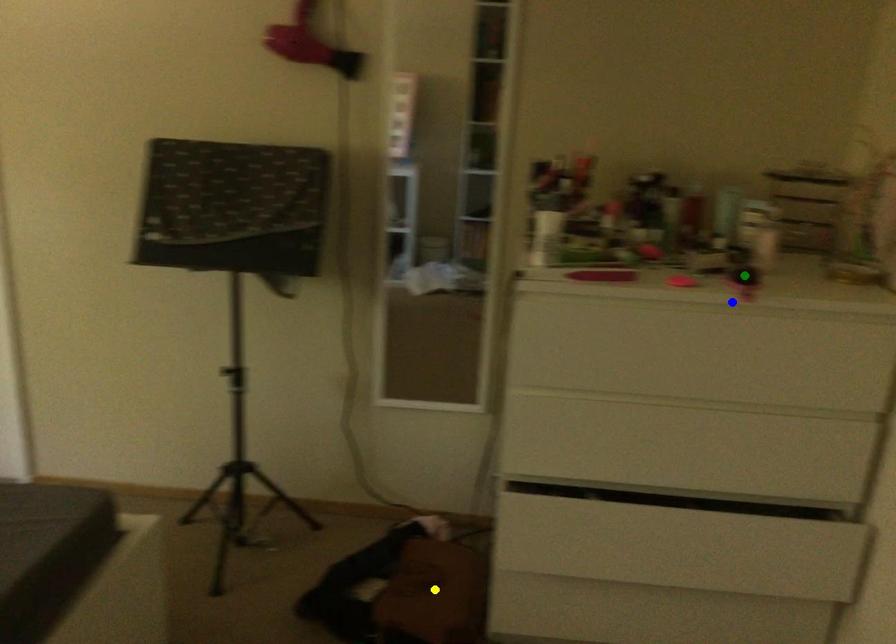
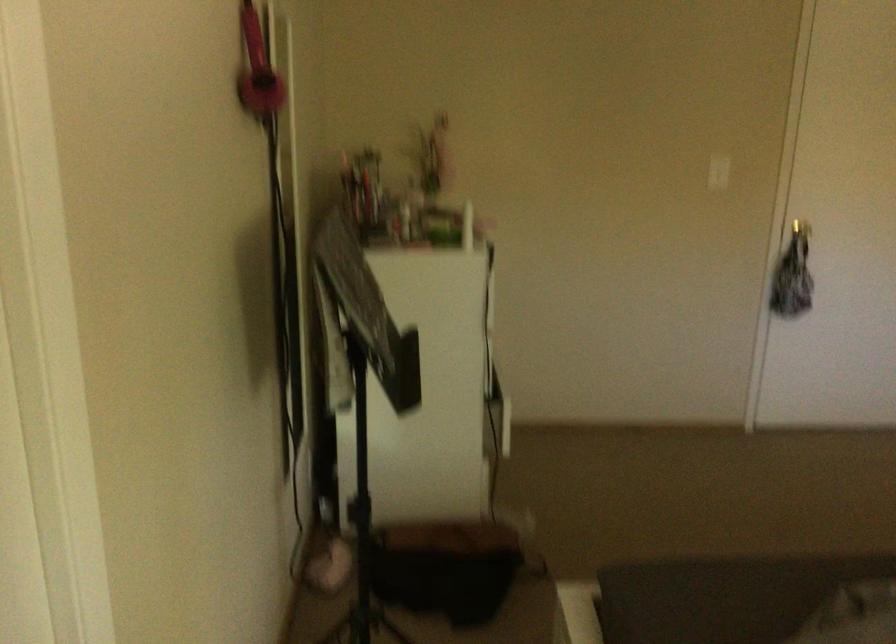
I am providing you with two images of the same scene from different viewpoints. Three points are marked in image1. Which point corresponds to a part or object that is occluded in image2?In image1, three points are marked. Which of them correspond to a part or object that is occluded in image2?Among the three points shown in image1, which one corresponds to a part or object that is no longer visible due to occlusion in image2?

green point, blue point, yellow point